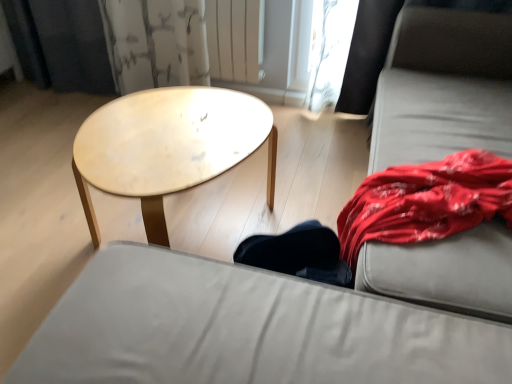
This screenshot has width=512, height=384. Describe the element at coordinates (246, 329) in the screenshot. I see `matte gray studio couch at center` at that location.

Identify the location of gray fabric couch at right. The height and width of the screenshot is (384, 512). (443, 88).

From the picture: Who is smaller, matte gray studio couch at center or white painted metal radiator at upper center?

white painted metal radiator at upper center.

Is matte gray studio couch at center shorter than white painted metal radiator at upper center?

No.

Is matte gray studio couch at center facing towards white painted metal radiator at upper center?

Yes, matte gray studio couch at center is oriented towards white painted metal radiator at upper center.

Is matte gray studio couch at center not close to white painted metal radiator at upper center?

matte gray studio couch at center is far away from white painted metal radiator at upper center.

Based on their sizes in the image, would you say gray fabric couch at right is bigger or smaller than light wood/texture coffee table at center?

In the image, gray fabric couch at right appears to be larger than light wood/texture coffee table at center.

From a real-world perspective, is gray fabric couch at right positioned under light wood/texture coffee table at center based on gravity?

Actually, gray fabric couch at right is physically above light wood/texture coffee table at center in the real world.

From the image's perspective, between gray fabric couch at right and light wood/texture coffee table at center, which one is located above?

gray fabric couch at right, from the image's perspective.

From a real-world perspective, is white painted metal radiator at upper center positioned under gray fabric couch at right based on gravity?

No.

Which of these two, white painted metal radiator at upper center or gray fabric couch at right, stands taller?

Standing taller between the two is gray fabric couch at right.

You are a GUI agent. You are given a task and a screenshot of the screen. Output one action in this format:
    pyautogui.click(x=<x>, y=<y>)
    Task: Click on the couch on the right of white painted metal radiator at upper center
    This screenshot has height=384, width=512.
    Given the screenshot: What is the action you would take?
    pyautogui.click(x=443, y=88)

Would you say white painted metal radiator at upper center is a long distance from gray fabric couch at right?

No, white painted metal radiator at upper center is not far away from gray fabric couch at right.

Can you confirm if gray fabric couch at right is positioned to the right of white painted metal radiator at upper center?

Yes.

From the picture: Is gray fabric couch at right taller or shorter than white painted metal radiator at upper center?

Clearly, gray fabric couch at right is taller compared to white painted metal radiator at upper center.

Is gray fabric couch at right behind white painted metal radiator at upper center?

No, it is not.

Is white painted metal radiator at upper center a part of gray fabric couch at right?

No, white painted metal radiator at upper center is not inside gray fabric couch at right.

Based on the photo, from the image's perspective, who appears lower, light wood/texture coffee table at center or matte gray studio couch at center?

matte gray studio couch at center, from the image's perspective.

From a real-world perspective, is light wood/texture coffee table at center positioned above or below matte gray studio couch at center?

light wood/texture coffee table at center is situated lower than matte gray studio couch at center in the real world.

Considering the positions of objects light wood/texture coffee table at center and matte gray studio couch at center in the image provided, who is more to the right, light wood/texture coffee table at center or matte gray studio couch at center?

From the viewer's perspective, matte gray studio couch at center appears more on the right side.

How different are the orientations of gray fabric couch at right and matte gray studio couch at center in degrees?

90.2 degrees separate the facing orientations of gray fabric couch at right and matte gray studio couch at center.

Is gray fabric couch at right taller than matte gray studio couch at center?

Yes, gray fabric couch at right is taller than matte gray studio couch at center.

I want to click on couch on the right of matte gray studio couch at center, so click(443, 88).

Considering the positions of point (273, 135) and point (230, 40), is point (273, 135) closer or farther from the camera than point (230, 40)?

Point (273, 135).

Is light wood/texture coffee table at center spatially inside white painted metal radiator at upper center, or outside of it?

light wood/texture coffee table at center is outside white painted metal radiator at upper center.

Is white painted metal radiator at upper center at the back of light wood/texture coffee table at center?

light wood/texture coffee table at center is not turned away from white painted metal radiator at upper center.

Locate an element on the screen. Image resolution: width=512 pixels, height=384 pixels. radiator behind the matte gray studio couch at center is located at coordinates (234, 39).

This screenshot has height=384, width=512. Identify the location of coffee table located underneath the gray fabric couch at right (from a real-world perspective). (168, 147).

Which object lies further to the anchor point gray fabric couch at right, matte gray studio couch at center or white painted metal radiator at upper center?

white painted metal radiator at upper center.

Considering their positions, is gray fabric couch at right positioned closer to matte gray studio couch at center than light wood/texture coffee table at center?

Based on the image, light wood/texture coffee table at center appears to be nearer to matte gray studio couch at center.

When comparing their distances from light wood/texture coffee table at center, does matte gray studio couch at center or white painted metal radiator at upper center seem closer?

The object closer to light wood/texture coffee table at center is matte gray studio couch at center.

Based on their spatial positions, is light wood/texture coffee table at center or white painted metal radiator at upper center closer to gray fabric couch at right?

Based on the image, light wood/texture coffee table at center appears to be nearer to gray fabric couch at right.

Looking at this image, estimate the real-world distances between objects in this image. Which object is closer to light wood/texture coffee table at center, gray fabric couch at right or matte gray studio couch at center?

Among the two, matte gray studio couch at center is located nearer to light wood/texture coffee table at center.

Considering their positions, is white painted metal radiator at upper center positioned closer to gray fabric couch at right than matte gray studio couch at center?

matte gray studio couch at center lies closer to gray fabric couch at right than the other object.

Based on their spatial positions, is matte gray studio couch at center or gray fabric couch at right further from light wood/texture coffee table at center?

gray fabric couch at right lies further to light wood/texture coffee table at center than the other object.

When comparing their distances from matte gray studio couch at center, does light wood/texture coffee table at center or gray fabric couch at right seem further?

gray fabric couch at right lies further to matte gray studio couch at center than the other object.

Where is `coffee table located between matte gray studio couch at center and white painted metal radiator at upper center in the depth direction`? The image size is (512, 384). coffee table located between matte gray studio couch at center and white painted metal radiator at upper center in the depth direction is located at coordinates (168, 147).

The width and height of the screenshot is (512, 384). I want to click on coffee table between gray fabric couch at right and white painted metal radiator at upper center in the front-back direction, so click(168, 147).

Where is `couch between matte gray studio couch at center and white painted metal radiator at upper center in the front-back direction`? couch between matte gray studio couch at center and white painted metal radiator at upper center in the front-back direction is located at coordinates (443, 88).

Image resolution: width=512 pixels, height=384 pixels. I want to click on studio couch located between light wood/texture coffee table at center and gray fabric couch at right in the left-right direction, so click(246, 329).